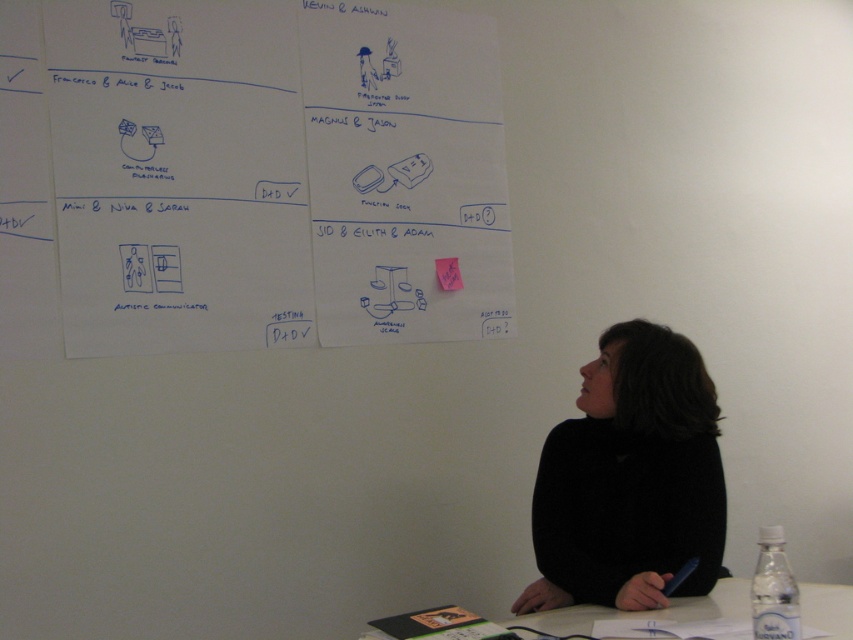
Question: Is white plastic table at lower center wider than pink paper at center?

Choices:
 (A) yes
 (B) no

Answer: (A)

Question: Is black matte sweater at lower right positioned at the back of white plastic table at lower center?

Choices:
 (A) yes
 (B) no

Answer: (A)

Question: Estimate the real-world distances between objects in this image. Which object is farther from the pink paper at center?

Choices:
 (A) black matte sweater at lower right
 (B) white plastic table at lower center

Answer: (B)

Question: Estimate the real-world distances between objects in this image. Which object is closer to the white plastic table at lower center?

Choices:
 (A) pink paper at center
 (B) black matte sweater at lower right

Answer: (B)

Question: Estimate the real-world distances between objects in this image. Which object is closer to the pink paper at center?

Choices:
 (A) white plastic table at lower center
 (B) black matte sweater at lower right

Answer: (B)

Question: Is white plastic table at lower center smaller than pink paper at center?

Choices:
 (A) no
 (B) yes

Answer: (A)